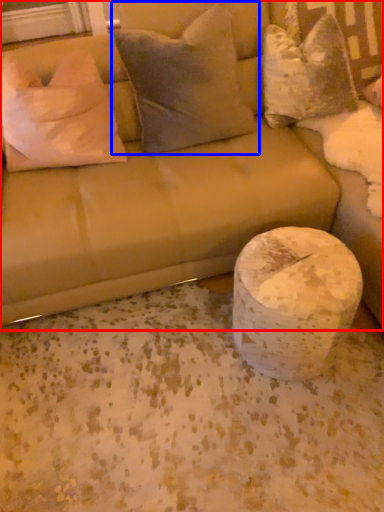
Question: Which of the following is the closest to the observer, studio couch (highlighted by a red box) or pillow (highlighted by a blue box)?

Choices:
 (A) studio couch
 (B) pillow

Answer: (A)